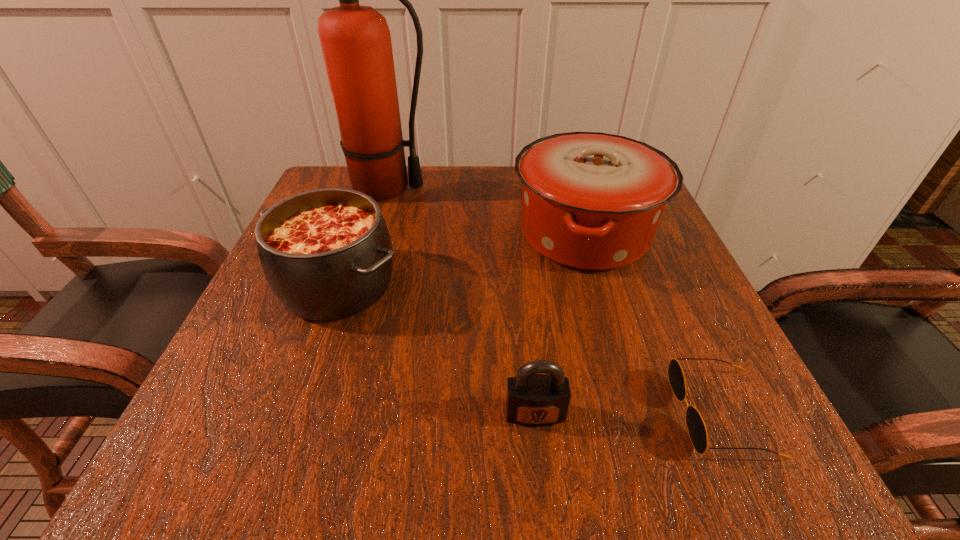
I want to click on vacant space located on the front of the second shortest object near the keyhole, so click(541, 474).

Locate an element on the screen. The height and width of the screenshot is (540, 960). vacant region located 0.340m on the front-facing side of the sunglasses is located at coordinates pos(427,413).

The width and height of the screenshot is (960, 540). What are the coordinates of `vacant space located 0.190m on the front-facing side of the sunglasses` in the screenshot? It's located at (538, 413).

Where is `free region located 0.270m on the front-facing side of the sunglasses`? The image size is (960, 540). free region located 0.270m on the front-facing side of the sunglasses is located at coordinates (478, 413).

Where is `fire extinguisher located in the far edge section of the desktop`? fire extinguisher located in the far edge section of the desktop is located at coordinates (356, 43).

This screenshot has height=540, width=960. I want to click on casserole that is at the far edge, so click(592, 201).

What are the coordinates of `padlock at the near edge` in the screenshot? It's located at pyautogui.click(x=532, y=399).

The height and width of the screenshot is (540, 960). What are the coordinates of `sunglasses that is positioned at the near edge` in the screenshot? It's located at (696, 427).

Locate an element on the screen. The image size is (960, 540). fire extinguisher positioned at the left edge is located at coordinates (356, 43).

Find the location of a particular element. This screenshot has width=960, height=540. casserole that is at the left edge is located at coordinates (326, 254).